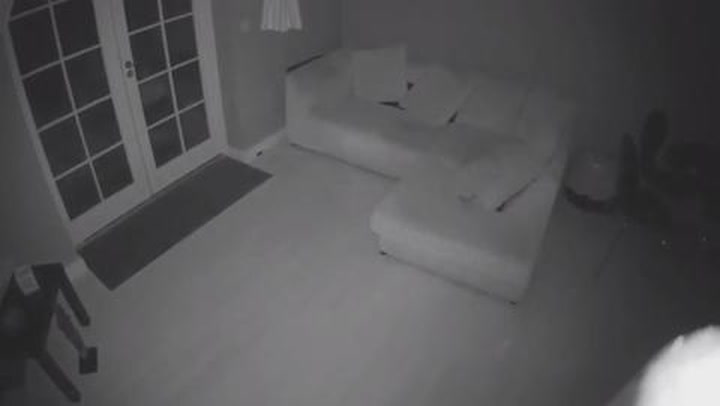
Identify the location of side table leg. The width and height of the screenshot is (720, 406). (48, 366), (76, 298).